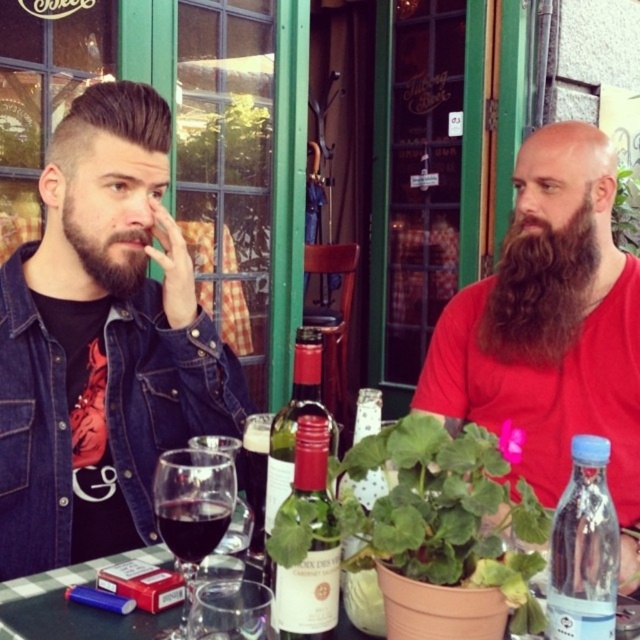
Can you confirm if white matte bottle at center is thinner than matte glass wine bottle at center?

Yes, white matte bottle at center is thinner than matte glass wine bottle at center.

Is white matte bottle at center to the right of matte glass wine bottle at center from the viewer's perspective?

Correct, you'll find white matte bottle at center to the right of matte glass wine bottle at center.

Is point (332, 560) closer to camera compared to point (326, 417)?

Yes, point (332, 560) is closer to viewer.

Identify the location of white matte bottle at center. (307, 593).

Measure the distance between point (x=132, y=308) and camera.

3.88 feet

Describe the element at coordinates (163, 392) in the screenshot. This screenshot has width=640, height=640. I see `brushed denim jacket at lower left` at that location.

Where is `brushed denim jacket at lower left`? This screenshot has height=640, width=640. brushed denim jacket at lower left is located at coordinates 163,392.

What do you see at coordinates (540, 289) in the screenshot?
I see `brown curly beard at right` at bounding box center [540, 289].

The width and height of the screenshot is (640, 640). I want to click on brown curly beard at right, so click(540, 289).